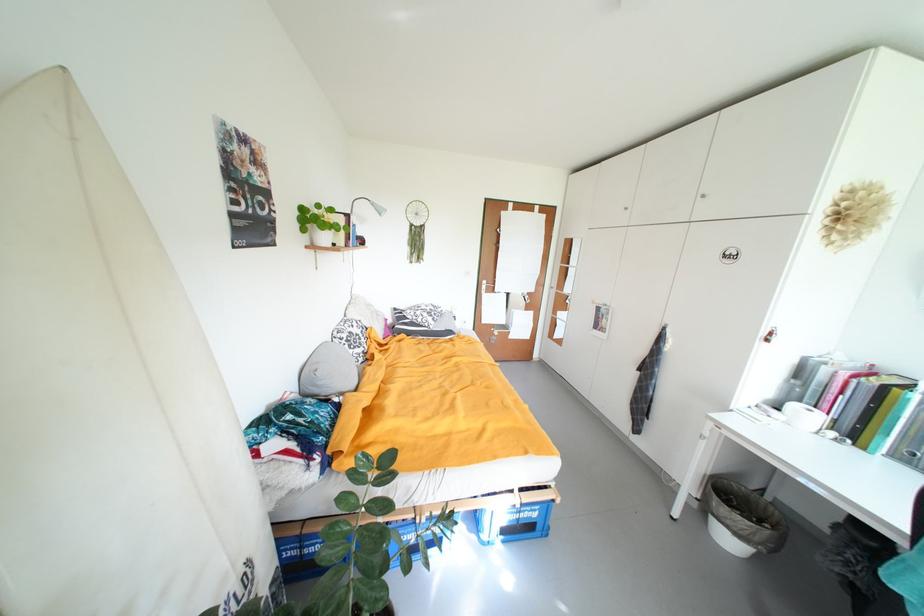
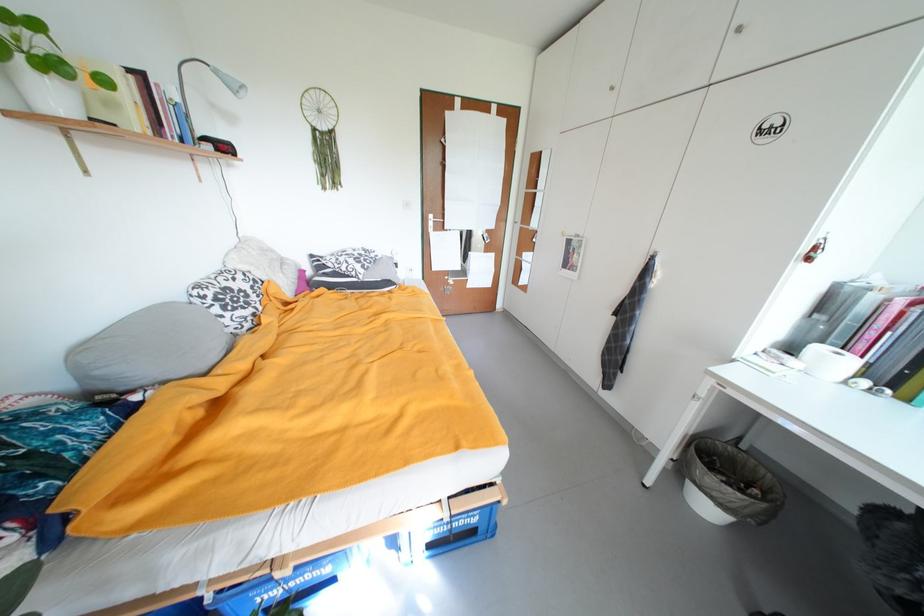
Question: I am providing you with two images of the same scene from different viewpoints. Which of the following objects are not visible in image2?

Choices:
 (A) patterned pillow
 (B) grey pillow
 (C) grey lamp head
 (D) none of these

Answer: (D)